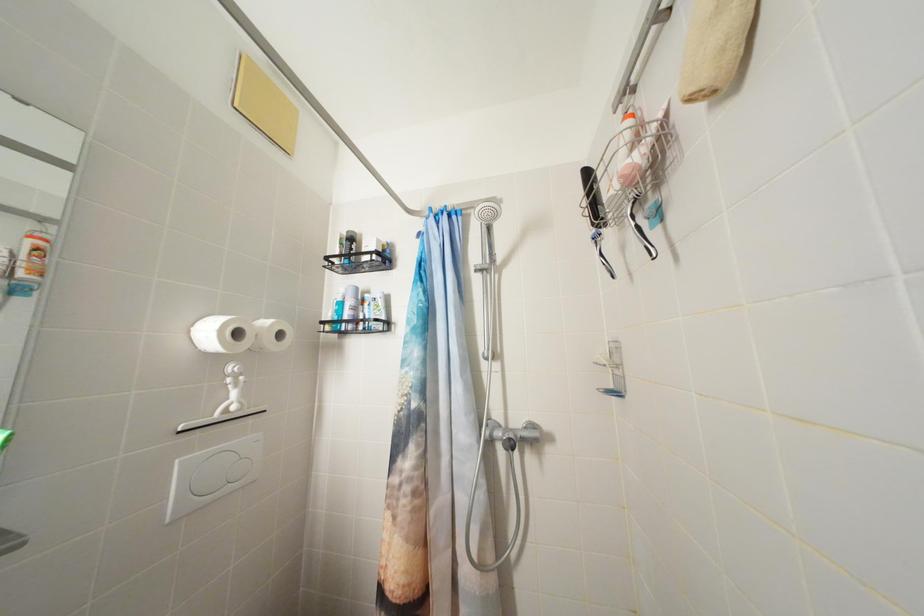
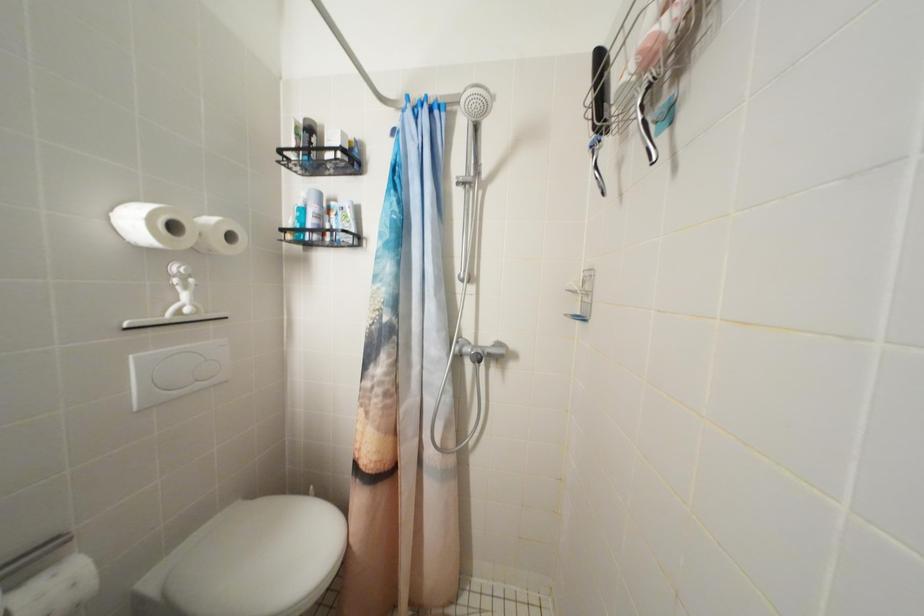
Question: The images are taken continuously from a first-person perspective. In which direction is your viewpoint rotating?

Choices:
 (A) Left
 (B) Right
 (C) Up
 (D) Down

Answer: (D)